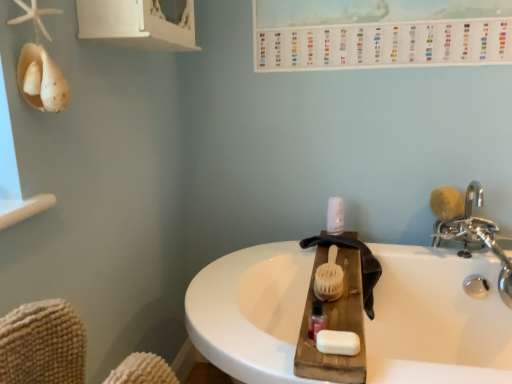
The image size is (512, 384). Find the location of `vacant area that lies between white bristle brush at center, which is counted as the first brush, starting from the left, and white matte soap at center`. vacant area that lies between white bristle brush at center, which is counted as the first brush, starting from the left, and white matte soap at center is located at coordinates (341, 306).